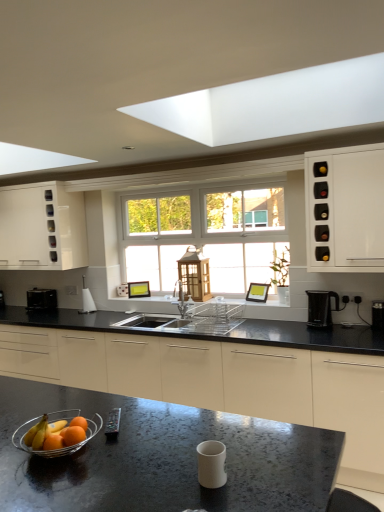
Where is `free space in front of clear glass bowl at lower left`? The width and height of the screenshot is (384, 512). free space in front of clear glass bowl at lower left is located at coordinates (57, 484).